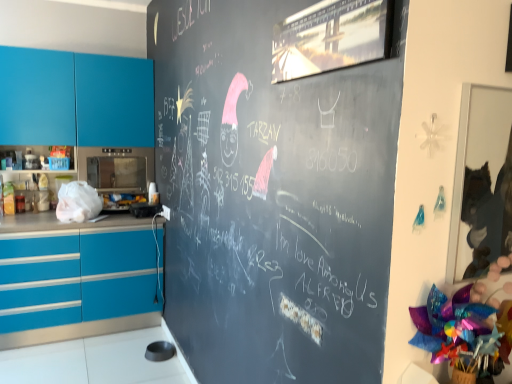
Question: Is the surface of metallic microwave at center-left, marked as the first appliance in a bottom-to-top arrangement, in direct contact with satin silver microwave at left, which ranks as the 1th appliance in top-to-bottom order?

Choices:
 (A) yes
 (B) no

Answer: (B)

Question: Considering the relative sizes of metallic microwave at center-left, marked as the first appliance in a bottom-to-top arrangement, and satin silver microwave at left, which ranks as the 1th appliance in top-to-bottom order, in the image provided, is metallic microwave at center-left, marked as the first appliance in a bottom-to-top arrangement, taller than satin silver microwave at left, which ranks as the 1th appliance in top-to-bottom order,?

Choices:
 (A) yes
 (B) no

Answer: (B)

Question: Is metallic microwave at center-left, marked as the second appliance in a top-to-bottom arrangement, turned away from satin silver microwave at left, the second appliance ordered from the bottom?

Choices:
 (A) yes
 (B) no

Answer: (B)

Question: Does metallic microwave at center-left, marked as the second appliance in a top-to-bottom arrangement, have a lesser height compared to satin silver microwave at left, which ranks as the 1th appliance in top-to-bottom order?

Choices:
 (A) no
 (B) yes

Answer: (B)

Question: Is metallic microwave at center-left, marked as the second appliance in a top-to-bottom arrangement, positioned far away from satin silver microwave at left, which ranks as the 1th appliance in top-to-bottom order?

Choices:
 (A) yes
 (B) no

Answer: (B)

Question: From a real-world perspective, is metallic microwave at center-left, marked as the second appliance in a top-to-bottom arrangement, located beneath satin silver microwave at left, the second appliance ordered from the bottom?

Choices:
 (A) yes
 (B) no

Answer: (A)

Question: Is satin silver microwave at left, the second appliance ordered from the bottom, beside metallic microwave at center-left, marked as the first appliance in a bottom-to-top arrangement?

Choices:
 (A) no
 (B) yes

Answer: (A)

Question: Is satin silver microwave at left, the second appliance ordered from the bottom, further to the viewer compared to metallic microwave at center-left, marked as the first appliance in a bottom-to-top arrangement?

Choices:
 (A) no
 (B) yes

Answer: (B)

Question: Could you tell me if satin silver microwave at left, which ranks as the 1th appliance in top-to-bottom order, is facing metallic microwave at center-left, marked as the first appliance in a bottom-to-top arrangement?

Choices:
 (A) yes
 (B) no

Answer: (B)

Question: Does satin silver microwave at left, the second appliance ordered from the bottom, have a greater width compared to metallic microwave at center-left, marked as the second appliance in a top-to-bottom arrangement?

Choices:
 (A) yes
 (B) no

Answer: (A)

Question: From the image's perspective, would you say satin silver microwave at left, the second appliance ordered from the bottom, is positioned over metallic microwave at center-left, marked as the first appliance in a bottom-to-top arrangement?

Choices:
 (A) yes
 (B) no

Answer: (A)

Question: Is satin silver microwave at left, which ranks as the 1th appliance in top-to-bottom order, bigger than metallic microwave at center-left, marked as the second appliance in a top-to-bottom arrangement?

Choices:
 (A) no
 (B) yes

Answer: (B)

Question: From the image's perspective, is metallic microwave at center-left, marked as the first appliance in a bottom-to-top arrangement, below teal glossy cabinets at left?

Choices:
 (A) yes
 (B) no

Answer: (A)